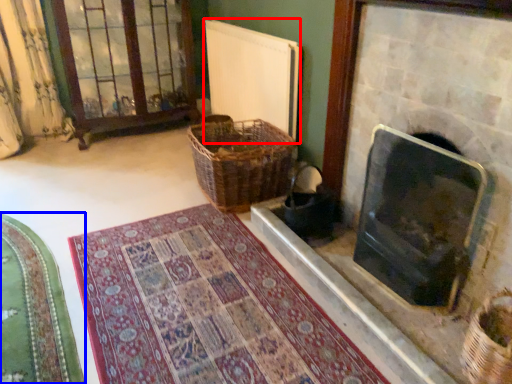
Question: Among these objects, which one is nearest to the camera, radiator (highlighted by a red box) or mat (highlighted by a blue box)?

Choices:
 (A) radiator
 (B) mat

Answer: (B)